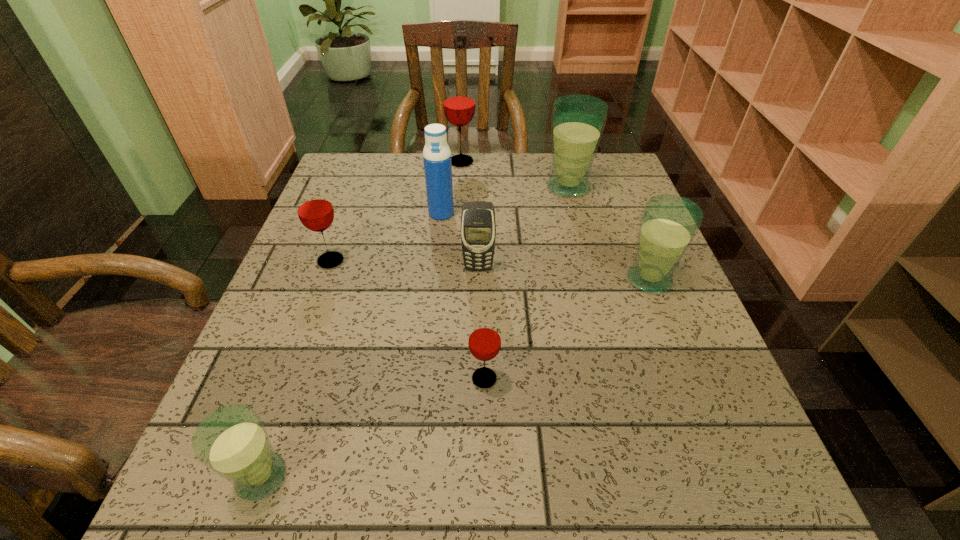
Locate an element on the screen. The height and width of the screenshot is (540, 960). the farthest red glass is located at coordinates (459, 106).

The width and height of the screenshot is (960, 540). Find the location of `the farthest object`. the farthest object is located at coordinates (459, 106).

Where is `the second farthest object`? The height and width of the screenshot is (540, 960). the second farthest object is located at coordinates (577, 121).

Identify the location of the farthest blue glass. (577, 121).

I want to click on blue water bottle, so click(436, 155).

You are a GUI agent. You are given a task and a screenshot of the screen. Output one action in this format:
    pyautogui.click(x=<x>, y=<y>)
    Task: Click on the water bottle
    This screenshot has height=540, width=960.
    Given the screenshot: What is the action you would take?
    pyautogui.click(x=436, y=155)

This screenshot has height=540, width=960. Identify the location of the second biggest red glass. (315, 211).

The image size is (960, 540). I want to click on the leftmost red glass, so click(x=315, y=211).

At what (x,y) coordinates should I click in order to perform the action: click on the rightmost object. Please return your answer as a coordinate pair (x, y). This screenshot has height=540, width=960. Looking at the image, I should click on (669, 223).

Where is `the second smallest blue glass`? the second smallest blue glass is located at coordinates (669, 223).